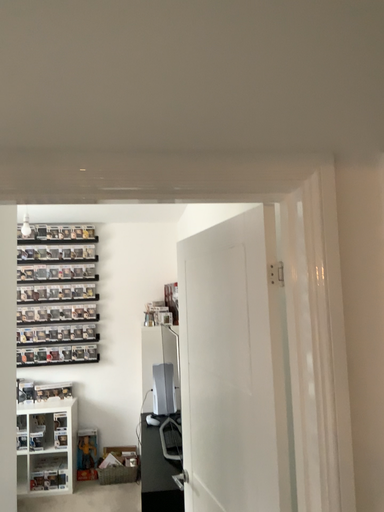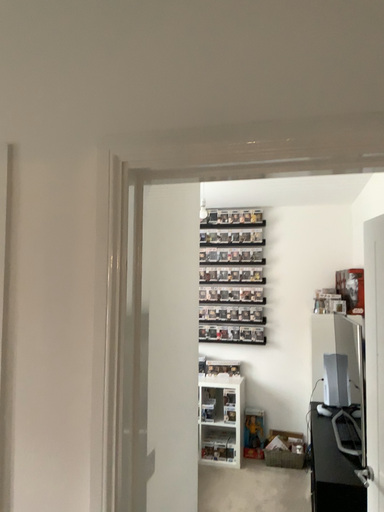
Question: How did the camera likely rotate when shooting the video?

Choices:
 (A) rotated right
 (B) rotated left

Answer: (B)